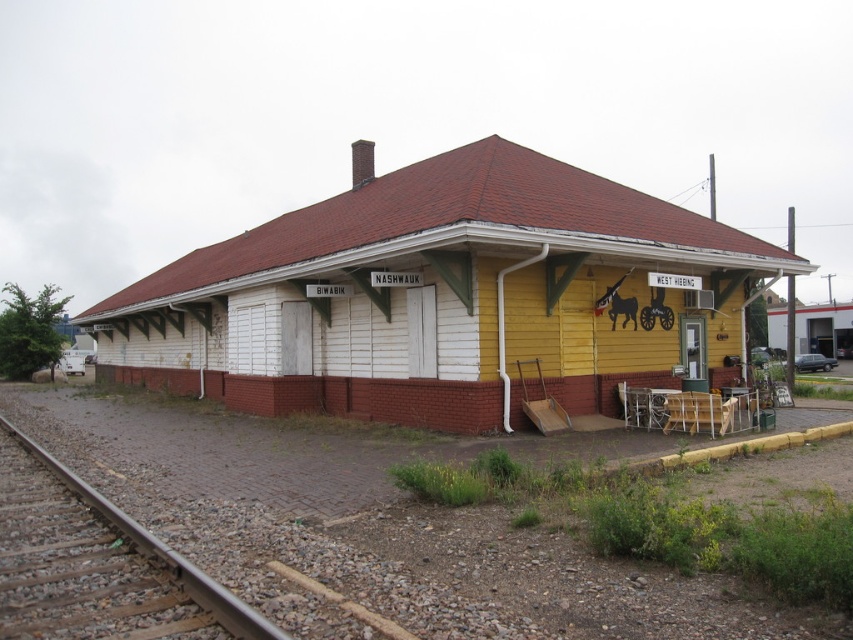
Does yellow wood railway station at center appear under brown wooden train track at lower left?

Incorrect, yellow wood railway station at center is not positioned below brown wooden train track at lower left.

Measure the distance between point (483, 154) and camera.

Point (483, 154) and camera are 56.38 feet apart from each other.

Identify the location of yellow wood railway station at center. (440, 296).